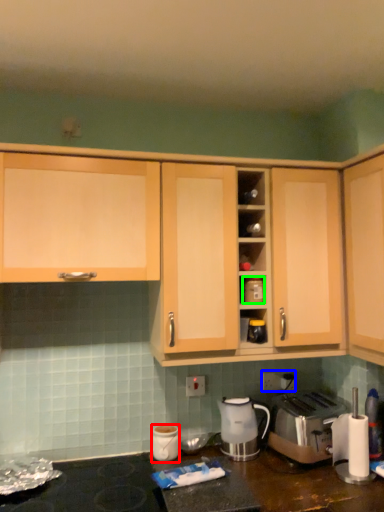
Question: Which is nearer to the kitchen appliance (highlighted by a red box)? electric outlet (highlighted by a blue box) or appliance (highlighted by a green box).

Choices:
 (A) electric outlet
 (B) appliance

Answer: (A)